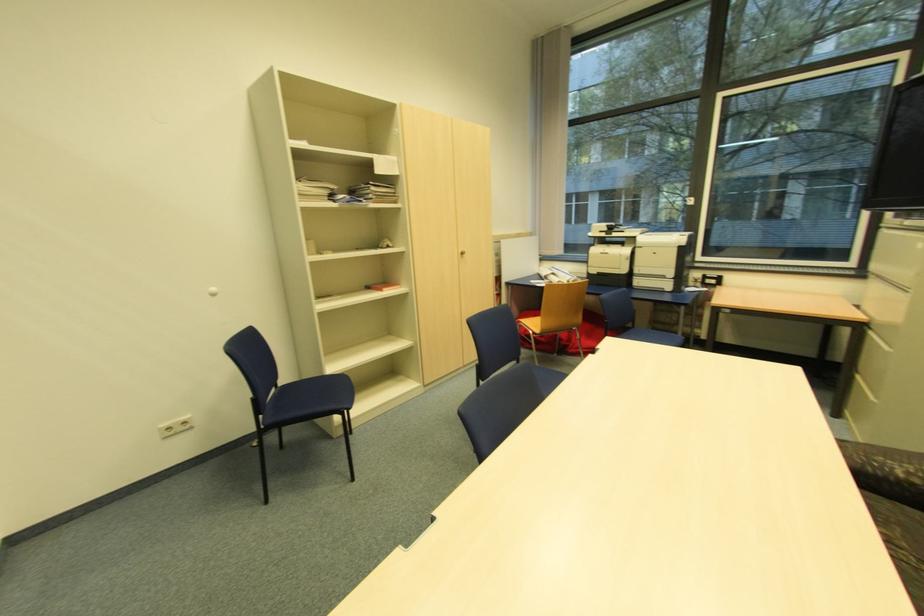
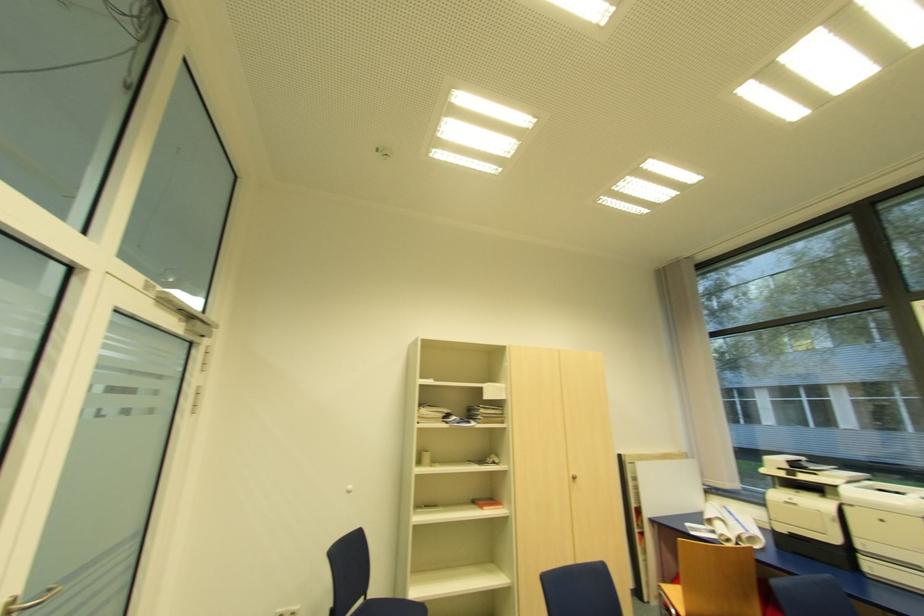
The images are taken continuously from a first-person perspective. In which direction is your viewpoint rotating?

The rotation direction of the camera is left-up.